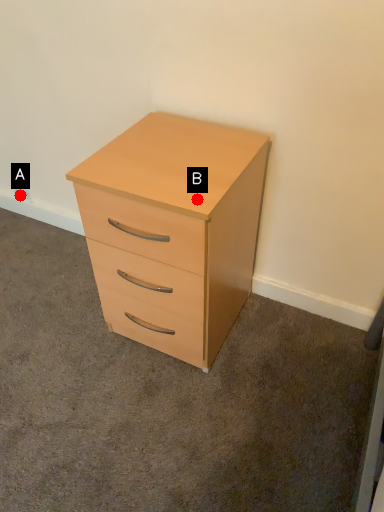
Question: Two points are circled on the image, labeled by A and B beside each circle. Which point is further to the camera?

Choices:
 (A) A is further
 (B) B is further

Answer: (A)